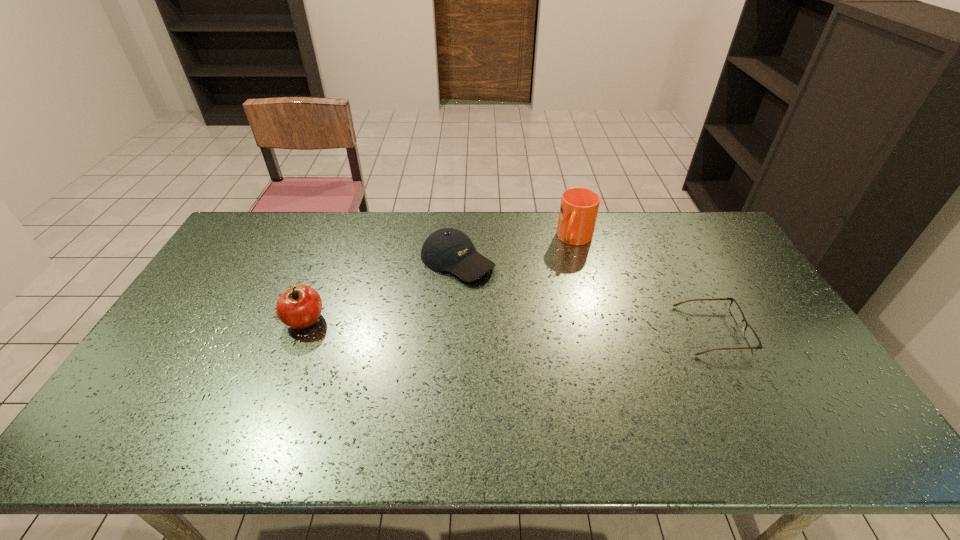
At what (x,y) coordinates should I click in order to perform the action: click on vacant space at the near edge. Please return your answer as a coordinate pair (x, y). Image resolution: width=960 pixels, height=540 pixels. Looking at the image, I should click on tap(331, 407).

The image size is (960, 540). I want to click on blank area at the left edge, so click(185, 322).

Locate an element on the screen. This screenshot has height=540, width=960. free region at the far right corner is located at coordinates (686, 226).

This screenshot has height=540, width=960. What are the coordinates of `free space between the second object from right to left and the leftmost object` in the screenshot? It's located at (440, 280).

At what (x,y) coordinates should I click in order to perform the action: click on empty location between the tallest object and the third shortest object. Please return your answer as a coordinate pair (x, y). Looking at the image, I should click on (440, 280).

At what (x,y) coordinates should I click in order to perform the action: click on vacant point located between the baseball cap and the apple. Please return your answer as a coordinate pair (x, y). Looking at the image, I should click on [381, 291].

Find the location of a particular element. This screenshot has width=960, height=540. free space between the leftmost object and the third object from right to left is located at coordinates (381, 291).

Where is `free point between the spectacles and the tallest object`? free point between the spectacles and the tallest object is located at coordinates (644, 285).

I want to click on free area in between the shortest object and the tallest object, so click(644, 285).

Locate an element on the screen. The height and width of the screenshot is (540, 960). free space between the rightmost object and the mug is located at coordinates (644, 285).